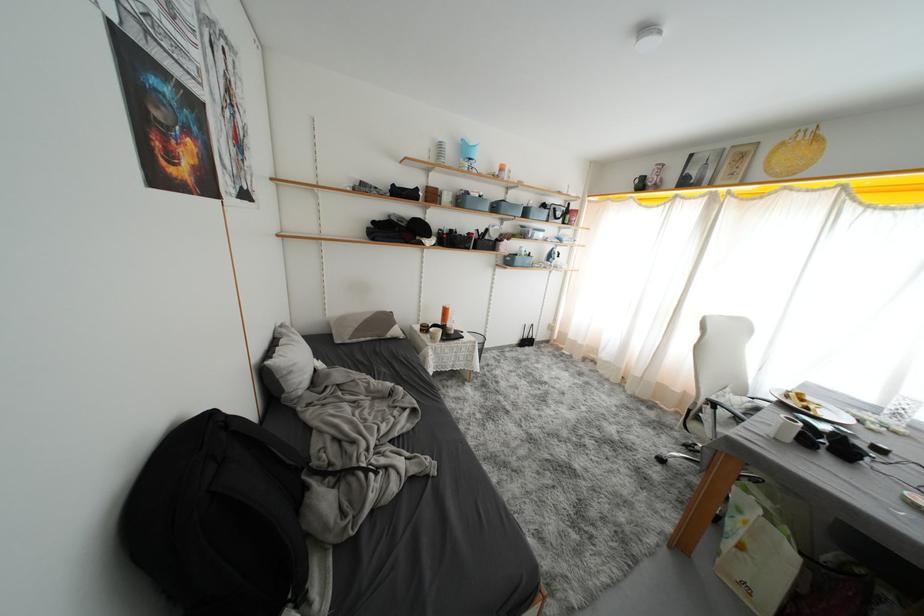
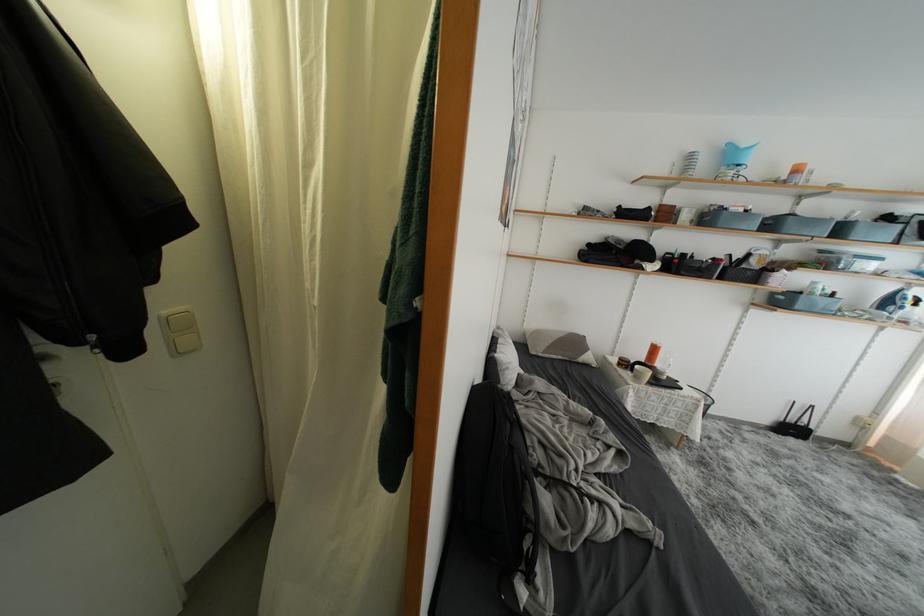
Locate, in the second image, the point that corresponds to (528,230) in the first image.

(829, 256)